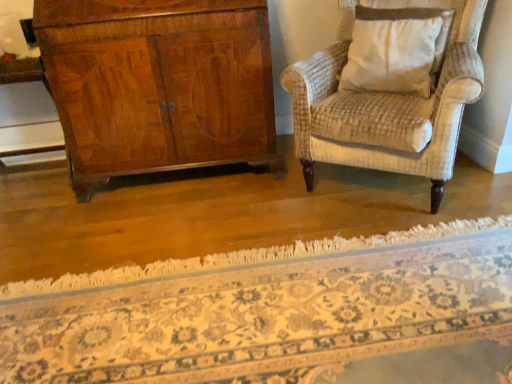
Locate an element on the screen. This screenshot has width=512, height=384. floral carpet at center is located at coordinates (261, 308).

What do you see at coordinates (261, 308) in the screenshot? I see `floral carpet at center` at bounding box center [261, 308].

In order to click on beige textured pillow at upper right in this screenshot , I will do `click(396, 50)`.

What do you see at coordinates (396, 50) in the screenshot? I see `beige textured pillow at upper right` at bounding box center [396, 50].

In order to face beige textured pillow at upper right, should I rotate leftwards or rightwards?

To align with it, rotate right about 18.233°.

Where is `floral carpet at center`? This screenshot has height=384, width=512. floral carpet at center is located at coordinates (261, 308).

Is beige textured pillow at upper right to the right of floral carpet at center from the viewer's perspective?

Yes, beige textured pillow at upper right is to the right of floral carpet at center.

Considering their positions, is beige textured pillow at upper right located in front of or behind floral carpet at center?

Visually, beige textured pillow at upper right is located behind floral carpet at center.

Considering the positions of points (432, 59) and (129, 353), is point (432, 59) closer to camera compared to point (129, 353)?

No, it is behind (129, 353).

From the image's perspective, who appears lower, beige textured pillow at upper right or floral carpet at center?

floral carpet at center, from the image's perspective.

From a real-world perspective, is beige textured pillow at upper right physically above floral carpet at center?

Indeed, from a real-world perspective, beige textured pillow at upper right stands above floral carpet at center.

Does beige textured pillow at upper right have a lesser width compared to floral carpet at center?

Indeed, beige textured pillow at upper right has a lesser width compared to floral carpet at center.

Which of these two, beige textured pillow at upper right or floral carpet at center, stands taller?

beige textured pillow at upper right is taller.

In the scene shown: Does beige textured pillow at upper right have a smaller size compared to floral carpet at center?

Yes, beige textured pillow at upper right is smaller than floral carpet at center.

Would you say beige textured pillow at upper right contains floral carpet at center?

No, beige textured pillow at upper right does not contain floral carpet at center.

Is beige textured pillow at upper right directly adjacent to floral carpet at center?

beige textured pillow at upper right is not next to floral carpet at center, and they're not touching.

Does beige textured pillow at upper right turn towards floral carpet at center?

No, beige textured pillow at upper right is not oriented towards floral carpet at center.

How many degrees apart are the facing directions of beige textured pillow at upper right and floral carpet at center?

35.4 degrees.

Measure the distance from beige textured pillow at upper right to floral carpet at center.

97.29 centimeters.

You are a GUI agent. You are given a task and a screenshot of the screen. Output one action in this format:
    pyautogui.click(x=<x>, y=<y>)
    Task: Click on the mat directly beneath the beige textured pillow at upper right (from a real-world perspective)
    Image resolution: width=512 pixels, height=384 pixels.
    Given the screenshot: What is the action you would take?
    pyautogui.click(x=261, y=308)

Which is more to the left, floral carpet at center or beige textured pillow at upper right?

From the viewer's perspective, floral carpet at center appears more on the left side.

Considering the positions of objects floral carpet at center and beige textured pillow at upper right in the image provided, who is in front, floral carpet at center or beige textured pillow at upper right?

Positioned in front is floral carpet at center.

Considering the positions of points (467, 250) and (365, 11), is point (467, 250) farther from camera compared to point (365, 11)?

No.

From the image's perspective, does floral carpet at center appear higher than beige textured pillow at upper right?

No.

Looking at this image, from a real-world perspective, is floral carpet at center below beige textured pillow at upper right?

Yes.

Which of these two, floral carpet at center or beige textured pillow at upper right, is thinner?

With smaller width is beige textured pillow at upper right.

Can you confirm if floral carpet at center is taller than beige textured pillow at upper right?

In fact, floral carpet at center may be shorter than beige textured pillow at upper right.

Does floral carpet at center have a smaller size compared to beige textured pillow at upper right?

No.

Is floral carpet at center situated inside beige textured pillow at upper right or outside?

floral carpet at center cannot be found inside beige textured pillow at upper right.

Is floral carpet at center beside beige textured pillow at upper right?

They are not placed beside each other.

Does floral carpet at center turn towards beige textured pillow at upper right?

No, floral carpet at center is not aimed at beige textured pillow at upper right.

How different are the orientations of floral carpet at center and beige textured pillow at upper right in degrees?

The angle between the facing direction of floral carpet at center and the facing direction of beige textured pillow at upper right is 35.4 degrees.

How much distance is there between floral carpet at center and beige textured pillow at upper right?

floral carpet at center is 38.30 inches from beige textured pillow at upper right.

Locate an element on the screen. This screenshot has width=512, height=384. mat that is below the beige textured pillow at upper right (from the image's perspective) is located at coordinates (261, 308).

Image resolution: width=512 pixels, height=384 pixels. Find the location of `mat that appears on the left of beige textured pillow at upper right`. mat that appears on the left of beige textured pillow at upper right is located at coordinates (261, 308).

At what (x,y) coordinates should I click in order to perform the action: click on pillow that is on the right side of floral carpet at center. Please return your answer as a coordinate pair (x, y). This screenshot has height=384, width=512. Looking at the image, I should click on (396, 50).